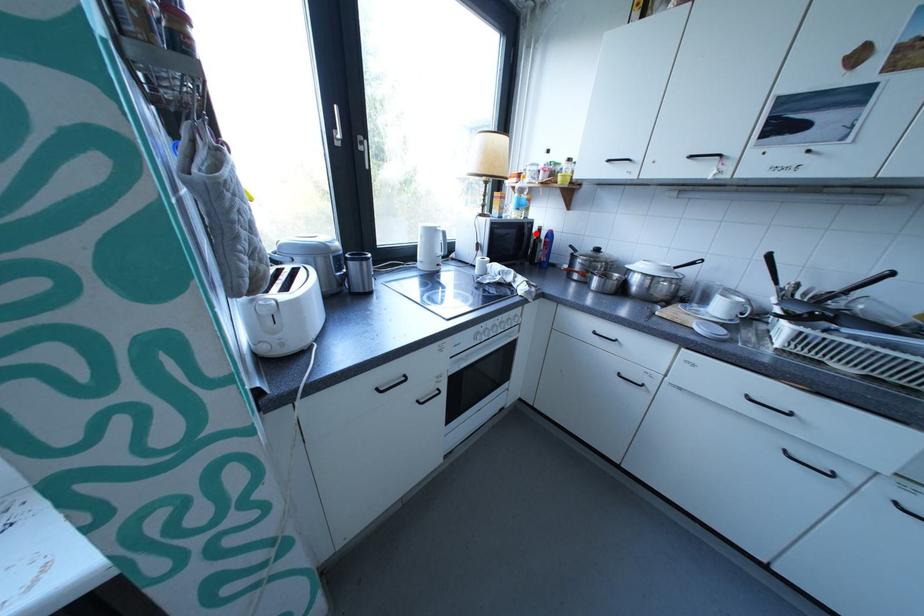
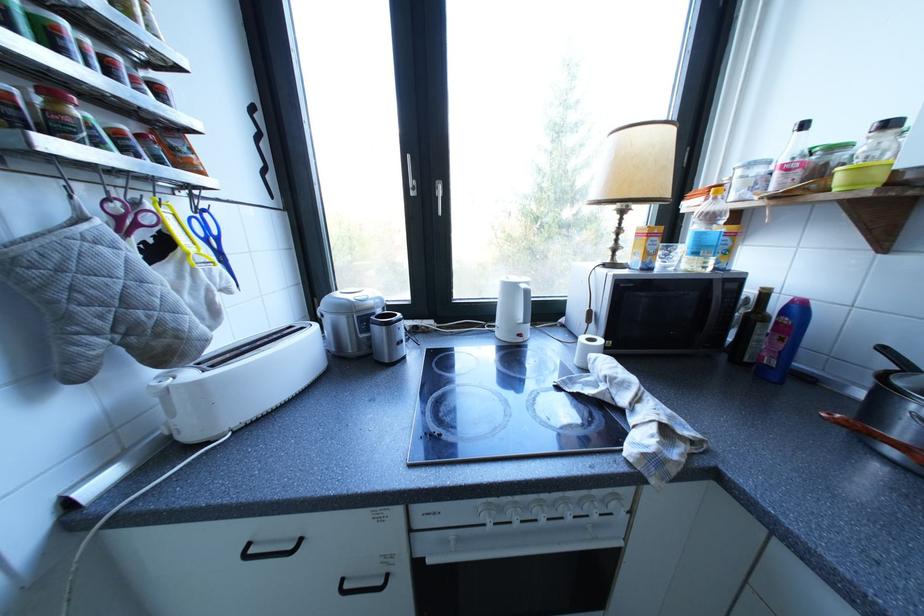
Locate, in the second image, the point that corresponds to the highlighted location in the first image.

(723, 301)